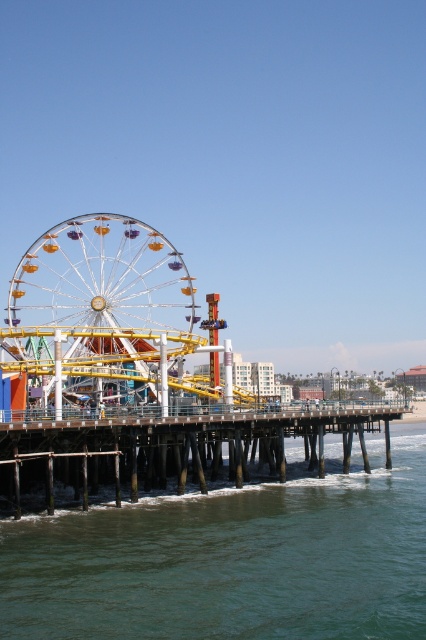
Does greenish-blue water at lower center have a greater height compared to brown wooden dock at lower center?

Incorrect, greenish-blue water at lower center's height is not larger of brown wooden dock at lower center's.

Is greenish-blue water at lower center to the right of brown wooden dock at lower center from the viewer's perspective?

Indeed, greenish-blue water at lower center is positioned on the right side of brown wooden dock at lower center.

Describe the element at coordinates (232, 561) in the screenshot. I see `greenish-blue water at lower center` at that location.

At what (x,y) coordinates should I click in order to perform the action: click on greenish-blue water at lower center. Please return your answer as a coordinate pair (x, y). Looking at the image, I should click on (232, 561).

This screenshot has width=426, height=640. I want to click on greenish-blue water at lower center, so click(232, 561).

Between point (304, 572) and point (80, 397), which one is positioned behind?

Point (80, 397)

Does point (370, 454) come in front of point (106, 246)?

Yes, point (370, 454) is in front of point (106, 246).

Locate an element on the screen. The width and height of the screenshot is (426, 640). greenish-blue water at lower center is located at coordinates (232, 561).

Identify the location of brown wooden dock at lower center. (169, 452).

Which is in front, point (250, 432) or point (77, 253)?

Point (250, 432) is more forward.

Between point (106, 422) and point (115, 269), which one is positioned behind?

The point (115, 269) is behind.

Locate an element on the screen. Image resolution: width=426 pixels, height=640 pixels. brown wooden dock at lower center is located at coordinates (169, 452).